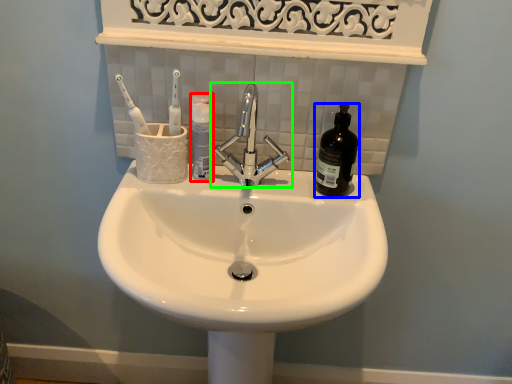
Question: Estimate the real-world distances between objects in this image. Which object is farther from mouthwash (highlighted by a red box), mouthwash (highlighted by a blue box) or tap (highlighted by a green box)?

Choices:
 (A) mouthwash
 (B) tap

Answer: (A)